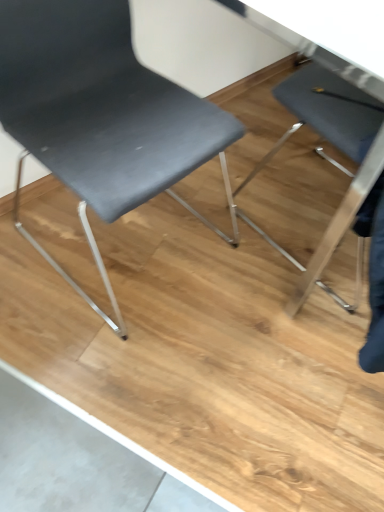
Locate an element on the screen. The height and width of the screenshot is (512, 384). vacant space in front of matte black chair at right, marked as the 1th chair in a right-to-left arrangement is located at coordinates (280, 354).